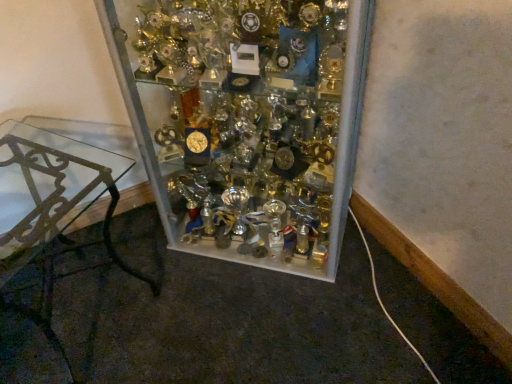
Question: Considering the relative sizes of clear glass trophy case at center and clear glass table at left in the image provided, is clear glass trophy case at center wider than clear glass table at left?

Choices:
 (A) yes
 (B) no

Answer: (A)

Question: Can you confirm if clear glass trophy case at center is positioned to the right of clear glass table at left?

Choices:
 (A) yes
 (B) no

Answer: (A)

Question: From a real-world perspective, is clear glass trophy case at center on top of clear glass table at left?

Choices:
 (A) no
 (B) yes

Answer: (B)

Question: Is clear glass trophy case at center to the left of clear glass table at left from the viewer's perspective?

Choices:
 (A) no
 (B) yes

Answer: (A)

Question: Is there a large distance between clear glass trophy case at center and clear glass table at left?

Choices:
 (A) no
 (B) yes

Answer: (A)

Question: From the image's perspective, would you say clear glass trophy case at center is shown under clear glass table at left?

Choices:
 (A) no
 (B) yes

Answer: (A)

Question: Would you say clear glass trophy case at center is part of clear glass table at left's contents?

Choices:
 (A) yes
 (B) no

Answer: (B)

Question: Considering the relative sizes of clear glass table at left and clear glass trophy case at center in the image provided, is clear glass table at left shorter than clear glass trophy case at center?

Choices:
 (A) no
 (B) yes

Answer: (B)

Question: From the image's perspective, is clear glass table at left located beneath clear glass trophy case at center?

Choices:
 (A) yes
 (B) no

Answer: (A)

Question: Is clear glass table at left bigger than clear glass trophy case at center?

Choices:
 (A) yes
 (B) no

Answer: (B)

Question: Can you confirm if clear glass table at left is taller than clear glass trophy case at center?

Choices:
 (A) yes
 (B) no

Answer: (B)

Question: Could you tell me if clear glass table at left is turned towards clear glass trophy case at center?

Choices:
 (A) no
 (B) yes

Answer: (A)

Question: From a real-world perspective, is clear glass trophy case at center above or below clear glass table at left?

Choices:
 (A) below
 (B) above

Answer: (B)